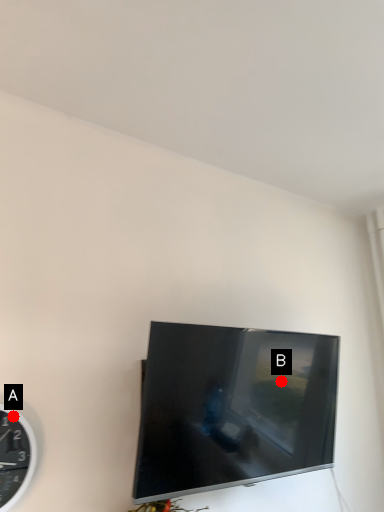
Question: Two points are circled on the image, labeled by A and B beside each circle. Which of the following is the farthest from the observer?

Choices:
 (A) A is further
 (B) B is further

Answer: (B)